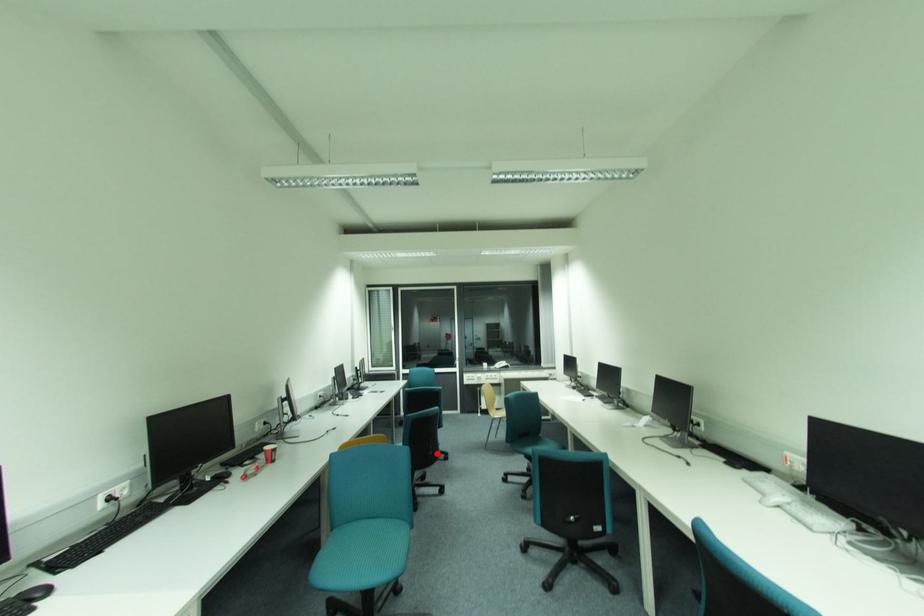
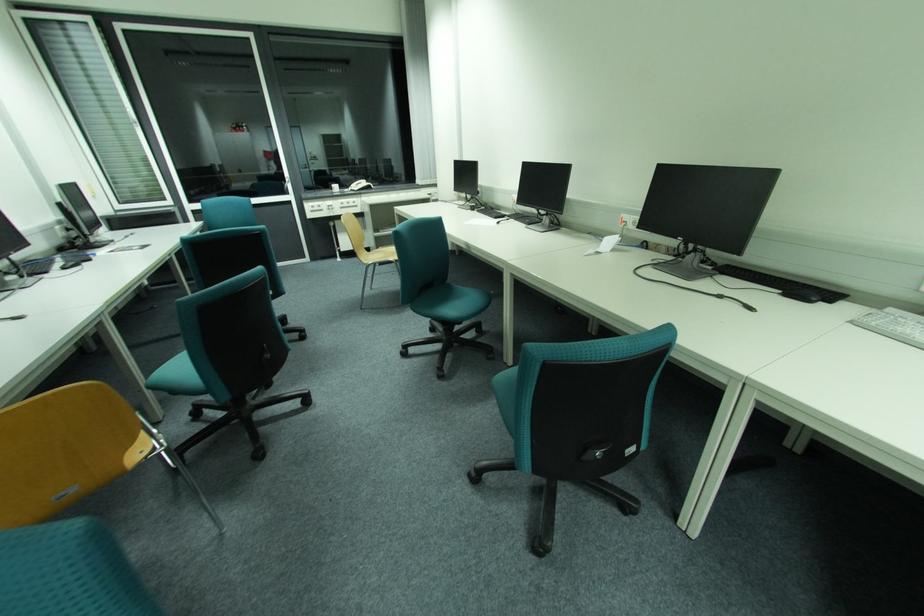
Question: I am providing you with two images of the same scene from different viewpoints. In image1, a red point is highlighted. Considering the same 3D point in image2, which of the following is correct?

Choices:
 (A) It is closer
 (B) It is farther

Answer: (A)